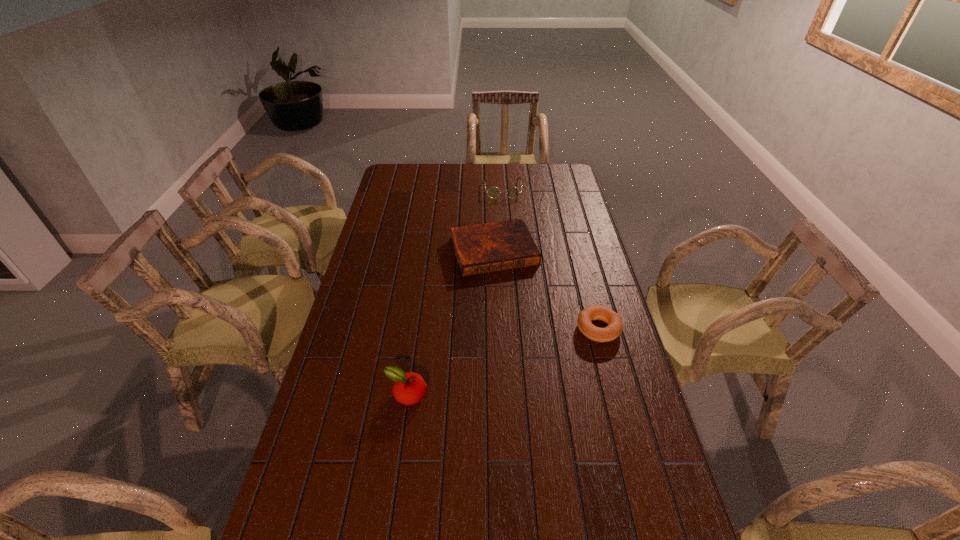
Where is `vacant space on the desktop that is between the tallest object and the third farthest object and is positioned on the lenses of the farthest object`? This screenshot has height=540, width=960. vacant space on the desktop that is between the tallest object and the third farthest object and is positioned on the lenses of the farthest object is located at coordinates (513, 358).

The image size is (960, 540). Identify the location of free space on the desktop that is between the apple and the rightmost object and is positioned on the spine side of the Bible. (534, 351).